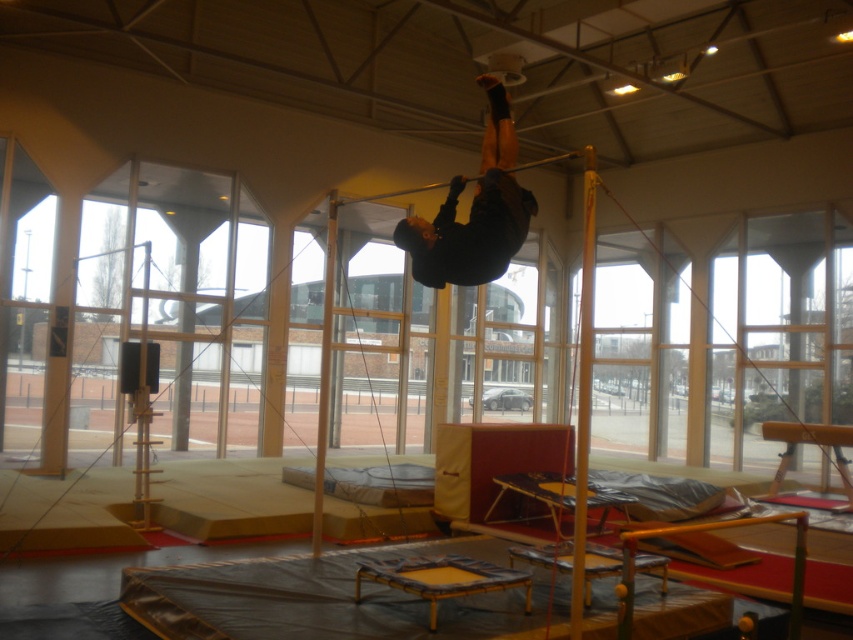
You are a physical therapist observing a patient in the gym. You see the black matte clothing at upper center and the black rubber bar at center. Which object is closer to you?

The black matte clothing at upper center is closer to you because it is further to the viewer than the black rubber bar at center.

From the picture: You are a gym instructor observing a person exercising. You notice the black matte clothing at upper center and the black rubber bar at center. Which object takes up more space in the image?

The black rubber bar at center takes up more space in the image than the black matte clothing at upper center because the black matte clothing at upper center occupies less space than black rubber bar at center.